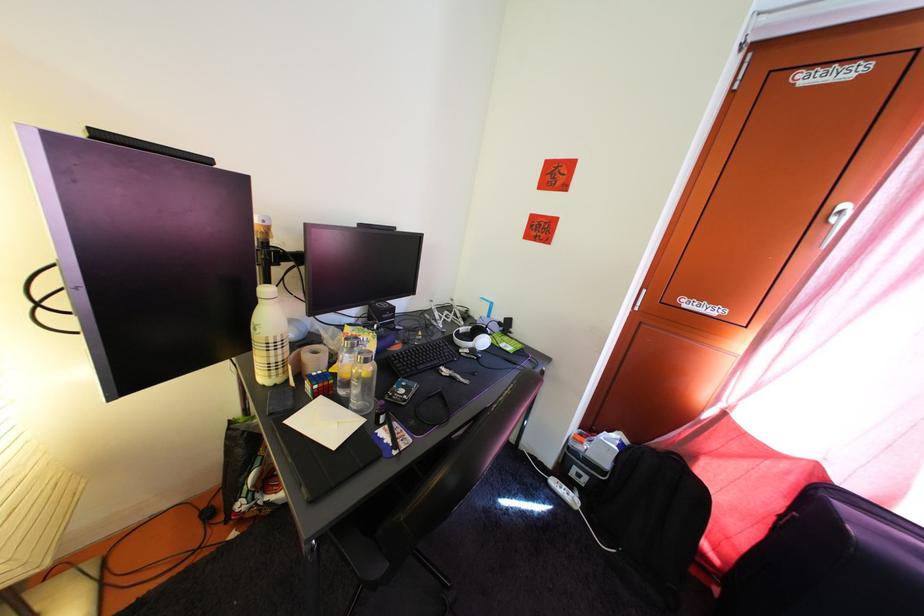
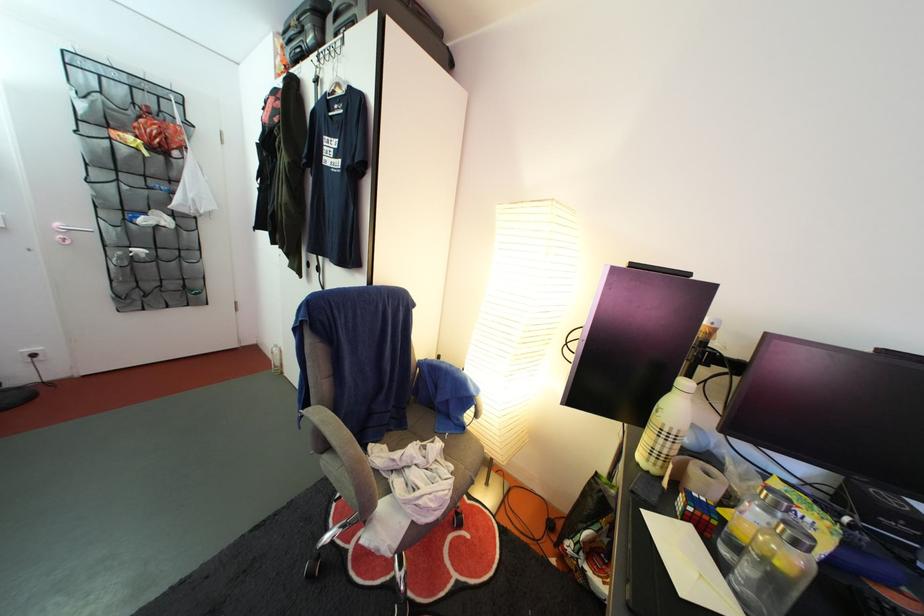
Question: The images are taken continuously from a first-person perspective. In which direction is your viewpoint rotating?

Choices:
 (A) Left
 (B) Right
 (C) Up
 (D) Down

Answer: (A)